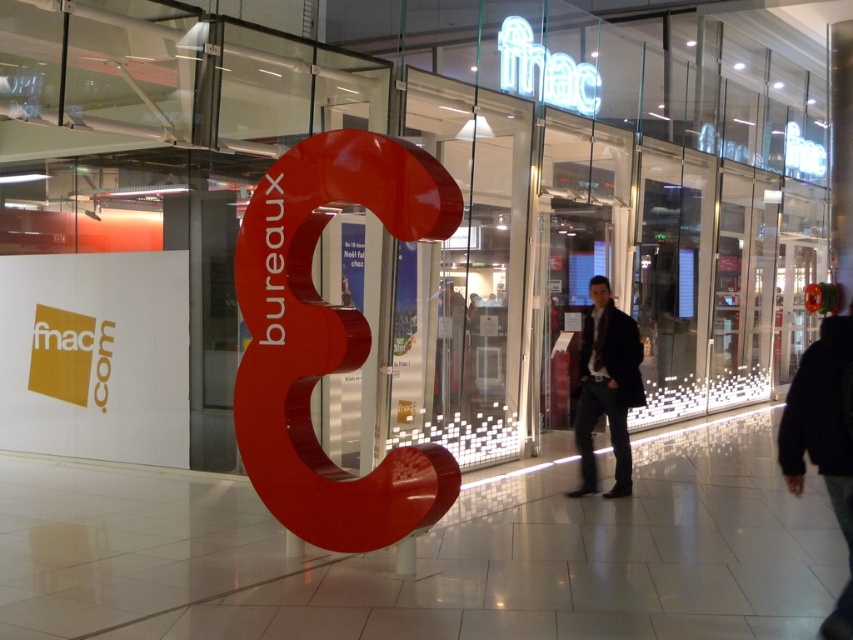
Is black fabric jacket at lower right taller than dark brown leather jacket at center?

Incorrect, black fabric jacket at lower right's height is not larger of dark brown leather jacket at center's.

Can you confirm if black fabric jacket at lower right is smaller than dark brown leather jacket at center?

No, black fabric jacket at lower right is not smaller than dark brown leather jacket at center.

Between point (849, 532) and point (595, 470), which one is positioned behind?

Point (595, 470)

Identify the location of black fabric jacket at lower right. Image resolution: width=853 pixels, height=640 pixels. [x=824, y=440].